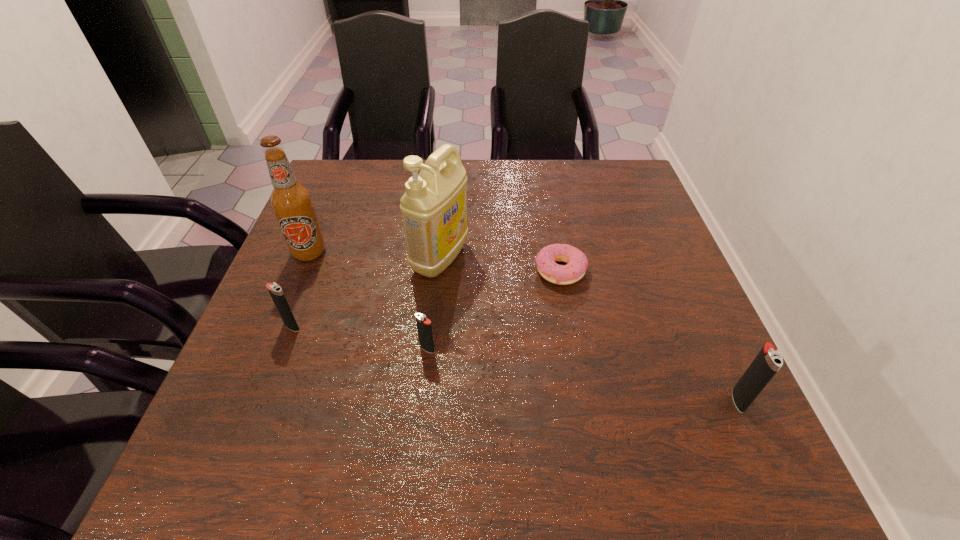
Locate an element on the screen. the third nearest object is located at coordinates (278, 297).

Image resolution: width=960 pixels, height=540 pixels. I want to click on the third shortest object, so click(x=278, y=297).

Identify the location of the second igniter from right to left. (424, 327).

Locate an element on the screen. Image resolution: width=960 pixels, height=540 pixels. the second nearest igniter is located at coordinates click(x=424, y=327).

Identify the location of the rightmost igniter. (766, 364).

The image size is (960, 540). I want to click on the nearest igniter, so click(766, 364).

Identify the location of detergent. (434, 207).

Where is `the second object from right to left`? The height and width of the screenshot is (540, 960). the second object from right to left is located at coordinates (577, 263).

The height and width of the screenshot is (540, 960). Find the location of `the shortest object`. the shortest object is located at coordinates (577, 263).

Identify the location of beer bottle. (291, 201).